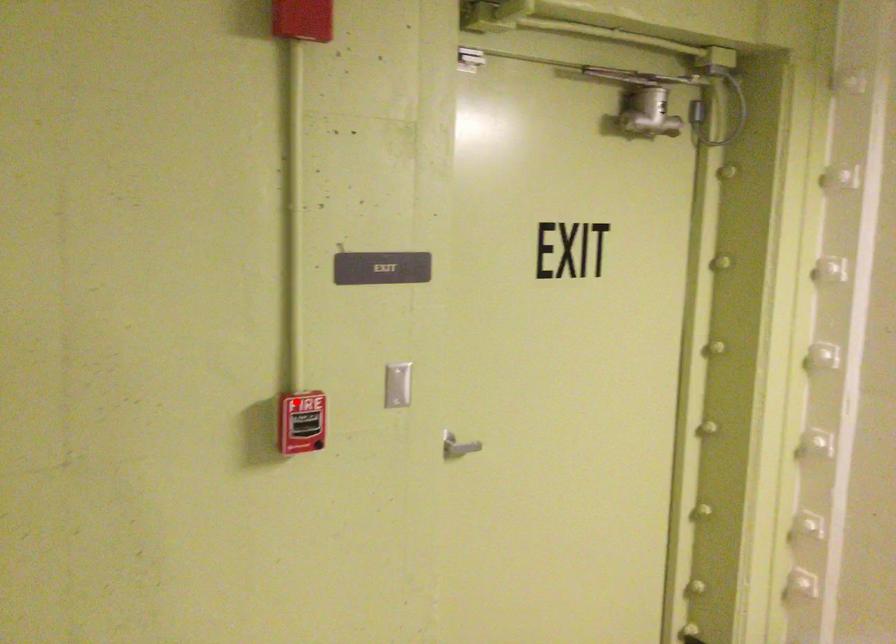
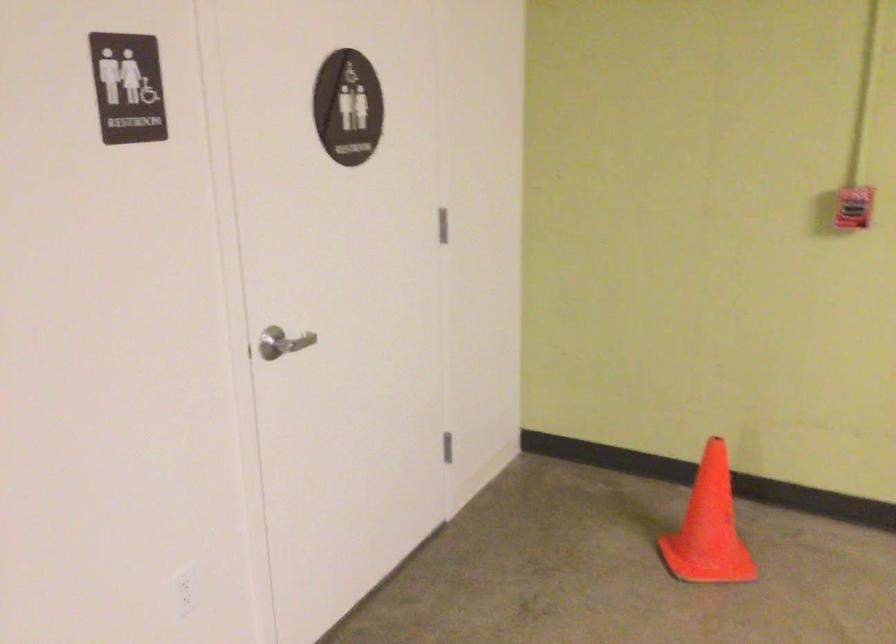
Question: I am providing you with two images of the same scene from different viewpoints. In image1, a red point is highlighted. Considering the same 3D point in image2, which of the following is correct?

Choices:
 (A) It is closer
 (B) It is farther

Answer: (B)